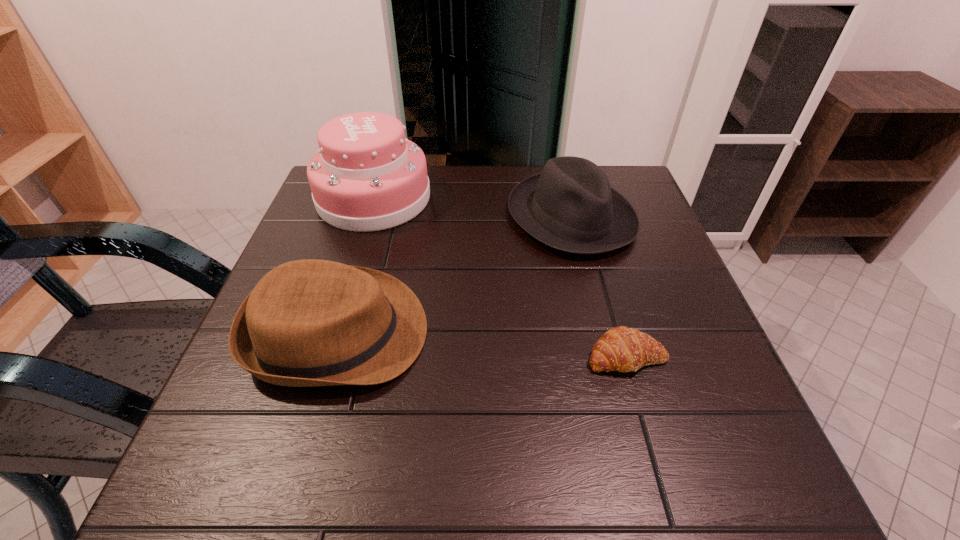
Locate an element on the screen. the tallest object is located at coordinates (366, 176).

Where is `the farther fedora`? This screenshot has height=540, width=960. the farther fedora is located at coordinates (570, 206).

Locate an element on the screen. the left fedora is located at coordinates (306, 323).

Where is `crescent roll`? Image resolution: width=960 pixels, height=540 pixels. crescent roll is located at coordinates (623, 349).

Locate an element on the screen. vacant space located on the front of the tallest object is located at coordinates (319, 379).

The width and height of the screenshot is (960, 540). I want to click on vacant space located on the left of the right fedora, so click(x=353, y=217).

Locate an element on the screen. This screenshot has width=960, height=540. free space located 0.110m on the front-facing side of the left fedora is located at coordinates (486, 333).

Where is `free point located 0.270m on the back of the shortest object`? The image size is (960, 540). free point located 0.270m on the back of the shortest object is located at coordinates (594, 244).

The width and height of the screenshot is (960, 540). What are the coordinates of `cake at the far edge` in the screenshot? It's located at (366, 176).

Find the location of a particular element. fedora that is at the far edge is located at coordinates (570, 206).